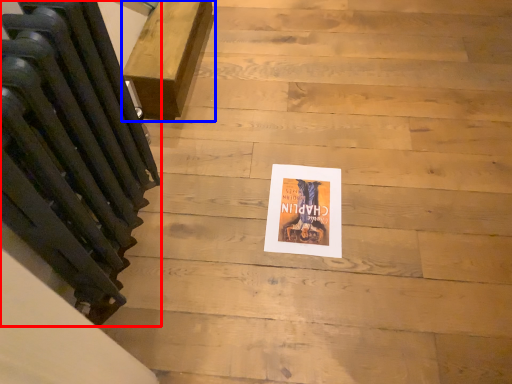
Question: Which point is further to the camera, radiator (highlighted by a red box) or furniture (highlighted by a blue box)?

Choices:
 (A) radiator
 (B) furniture

Answer: (B)